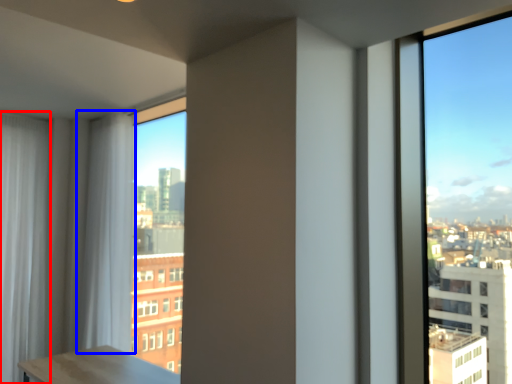
Question: Which object appears farthest to the camera in this image, curtain (highlighted by a red box) or curtain (highlighted by a blue box)?

Choices:
 (A) curtain
 (B) curtain

Answer: (A)